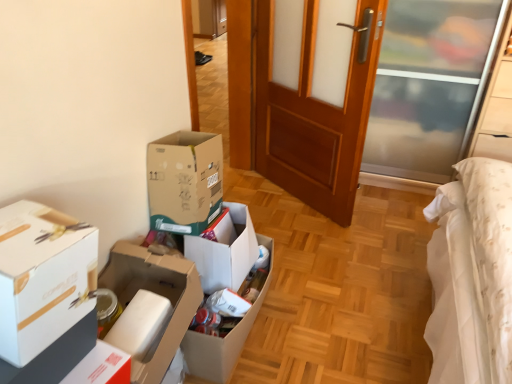
Question: Are cardboard box at center, the first box when ordered from back to front, and wooden door at center beside each other?

Choices:
 (A) no
 (B) yes

Answer: (A)

Question: From the image's perspective, is cardboard box at center, the first box when ordered from back to front, over wooden door at center?

Choices:
 (A) no
 (B) yes

Answer: (A)

Question: Is cardboard box at center, the first box when ordered from back to front, to the left of wooden door at center from the viewer's perspective?

Choices:
 (A) no
 (B) yes

Answer: (B)

Question: From a real-world perspective, is cardboard box at center, positioned as the third box in front-to-back order, physically above wooden door at center?

Choices:
 (A) no
 (B) yes

Answer: (A)

Question: Can wooden door at center be found inside cardboard box at center, the first box when ordered from back to front?

Choices:
 (A) yes
 (B) no

Answer: (B)

Question: Is wooden door at center bigger or smaller than cardboard box at center, the first box when ordered from back to front?

Choices:
 (A) big
 (B) small

Answer: (A)

Question: Choose the correct answer: Is wooden door at center inside cardboard box at center, the first box when ordered from back to front, or outside it?

Choices:
 (A) inside
 (B) outside

Answer: (B)

Question: In terms of width, does wooden door at center look wider or thinner when compared to cardboard box at center, positioned as the third box in front-to-back order?

Choices:
 (A) thin
 (B) wide

Answer: (A)

Question: From the image's perspective, relative to cardboard box at center, positioned as the third box in front-to-back order, is wooden door at center above or below?

Choices:
 (A) above
 (B) below

Answer: (A)

Question: Would you say cardboard box at center, positioned as the third box in front-to-back order, is to the left or to the right of white cardboard box at left, which is the third box in back-to-front order, in the picture?

Choices:
 (A) right
 (B) left

Answer: (A)

Question: Do you think cardboard box at center, the first box when ordered from back to front, is within white cardboard box at left, the first box from the front, or outside of it?

Choices:
 (A) outside
 (B) inside

Answer: (A)

Question: Is cardboard box at center, positioned as the third box in front-to-back order, taller or shorter than white cardboard box at left, the first box from the front?

Choices:
 (A) short
 (B) tall

Answer: (A)

Question: From the image's perspective, relative to white cardboard box at left, the first box from the front, is cardboard box at center, positioned as the third box in front-to-back order, above or below?

Choices:
 (A) above
 (B) below

Answer: (B)

Question: From a real-world perspective, relative to white cardboard box at center, the second box when ordered from front to back, is white cardboard box at left, the first box from the front, vertically above or below?

Choices:
 (A) below
 (B) above

Answer: (B)

Question: From the image's perspective, is white cardboard box at left, which is the third box in back-to-front order, located above or below white cardboard box at center, the second box when ordered from front to back?

Choices:
 (A) below
 (B) above

Answer: (B)